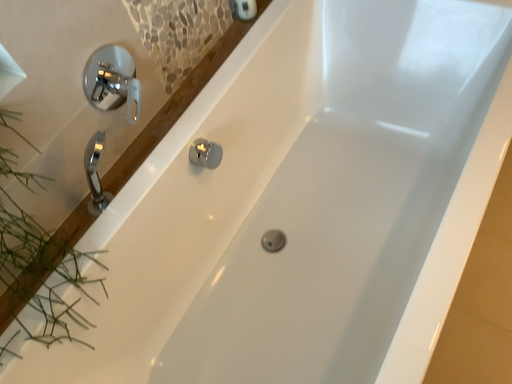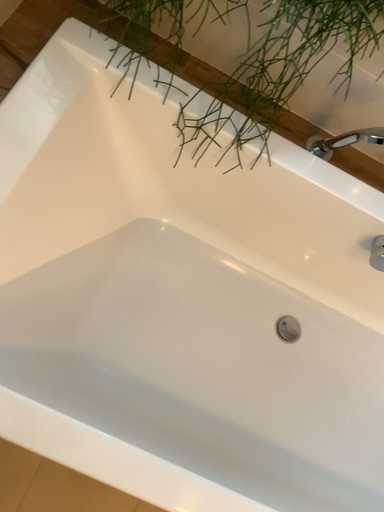
Question: How did the camera likely rotate when shooting the video?

Choices:
 (A) rotated right
 (B) rotated left

Answer: (B)